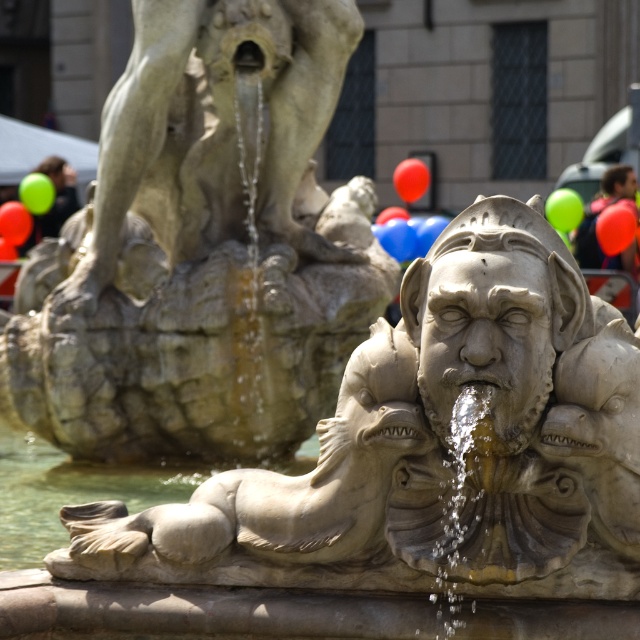
Who is more forward, (202,452) or (632,198)?

Point (202,452)

Is stone fountain at center behind blurred hair at center?

No, it is not.

Between point (92, 314) and point (584, 246), which one is positioned behind?

Point (584, 246)

Identify the location of stone fountain at center. (204, 248).